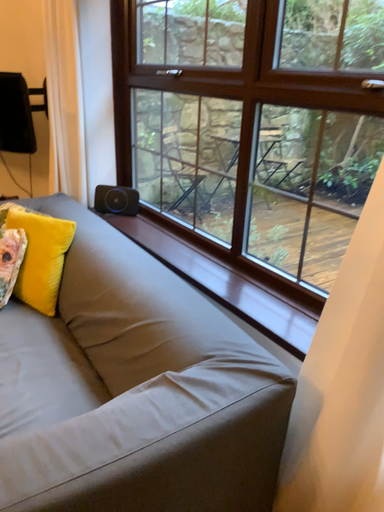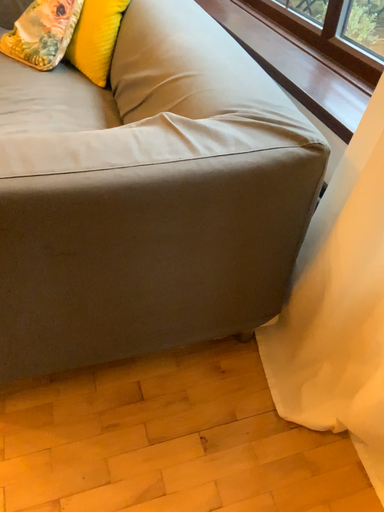
Question: Which way did the camera rotate in the video?

Choices:
 (A) rotated right
 (B) rotated left

Answer: (B)